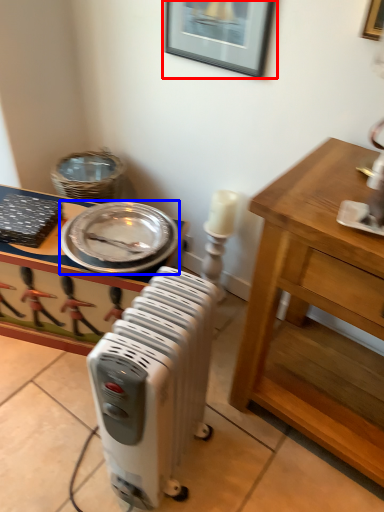
Question: Among these objects, which one is farthest to the camera, picture frame (highlighted by a red box) or platter (highlighted by a blue box)?

Choices:
 (A) picture frame
 (B) platter

Answer: (B)